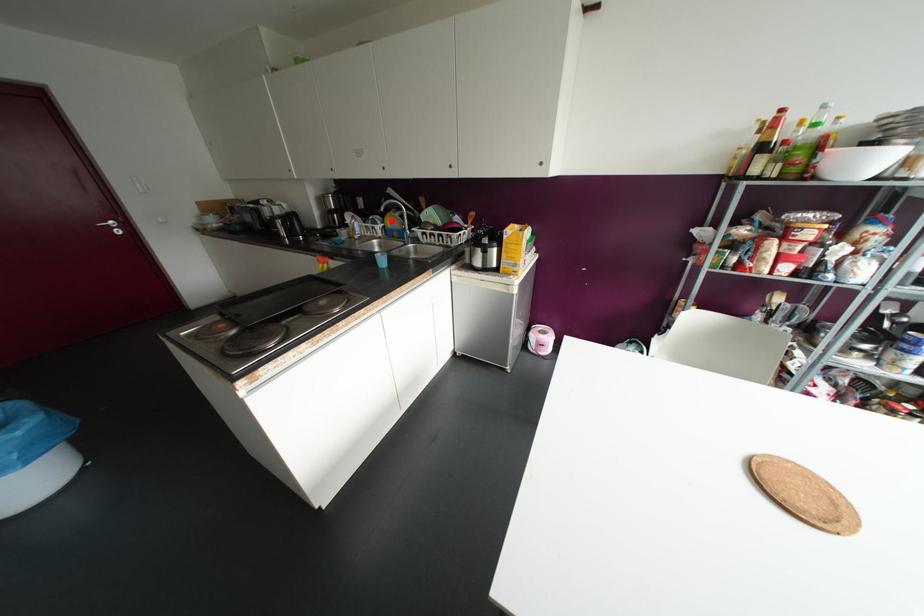
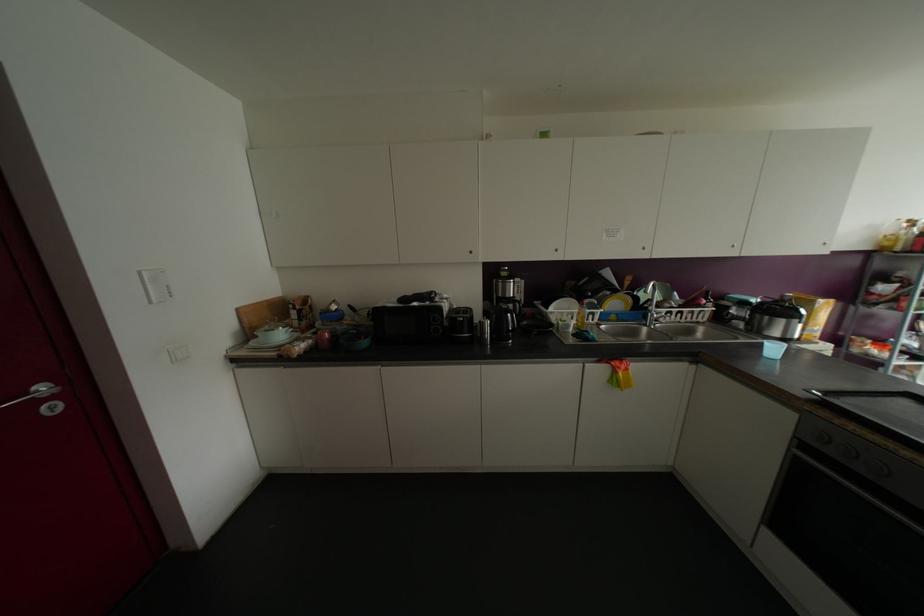
The point at the highlighted location is marked in the first image. Where is the corresponding point in the second image?

(614, 302)